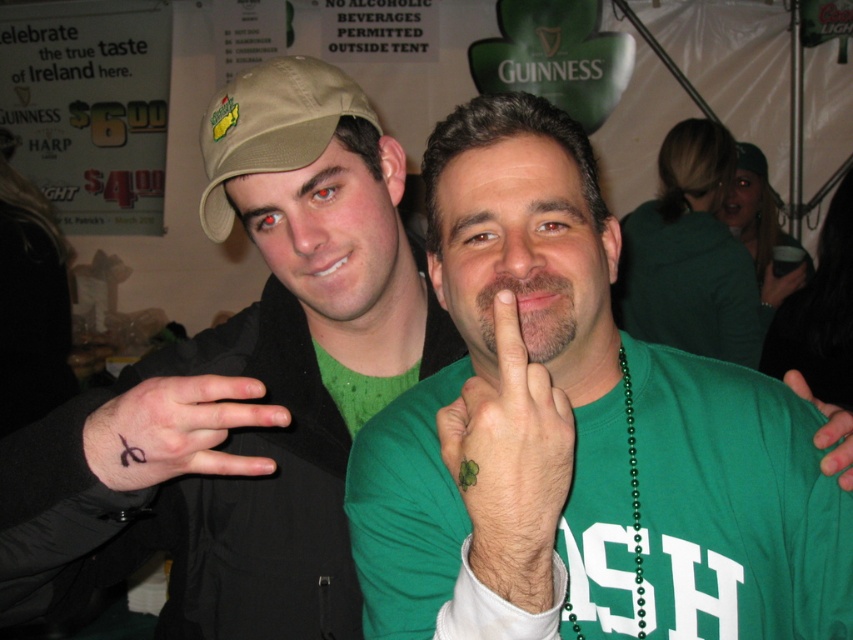
Does green matte shirt at center have a greater width compared to green matte hand at center?

Yes.

Is green matte shirt at center bigger than green matte hand at center?

Indeed, green matte shirt at center has a larger size compared to green matte hand at center.

Image resolution: width=853 pixels, height=640 pixels. What do you see at coordinates (578, 435) in the screenshot?
I see `green matte shirt at center` at bounding box center [578, 435].

Where is `green matte shirt at center`? This screenshot has width=853, height=640. green matte shirt at center is located at coordinates (578, 435).

Is tan fabric baseball cap at upper left wider than green fabric at center?

Yes.

Between tan fabric baseball cap at upper left and green fabric at center, which one is positioned lower?

green fabric at center is below.

Locate an element on the screen. tan fabric baseball cap at upper left is located at coordinates (271, 125).

Does matte green shirt at center appear on the right side of green matte hand at center?

In fact, matte green shirt at center is to the left of green matte hand at center.

What do you see at coordinates (242, 388) in the screenshot? Image resolution: width=853 pixels, height=640 pixels. I see `matte green shirt at center` at bounding box center [242, 388].

Locate an element on the screen. matte green shirt at center is located at coordinates (242, 388).